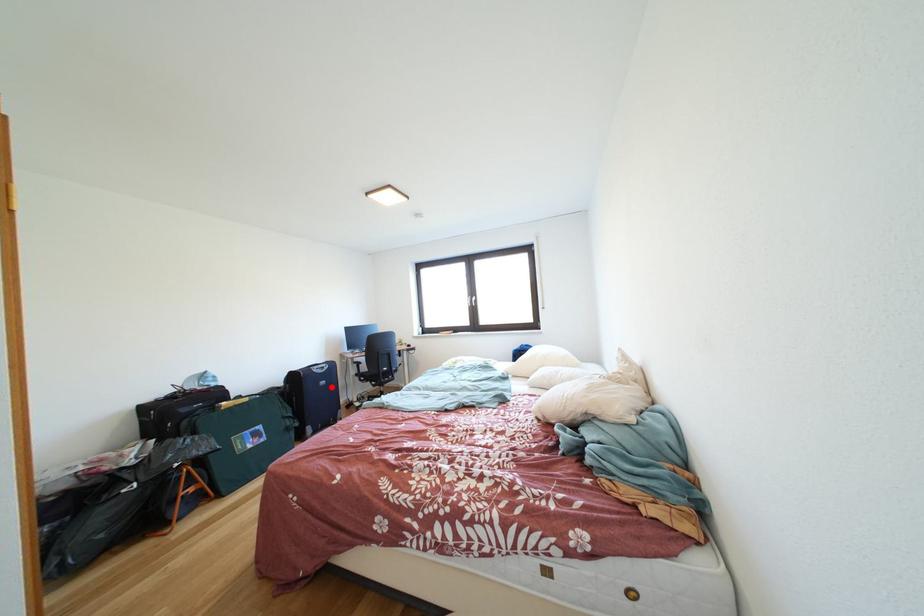
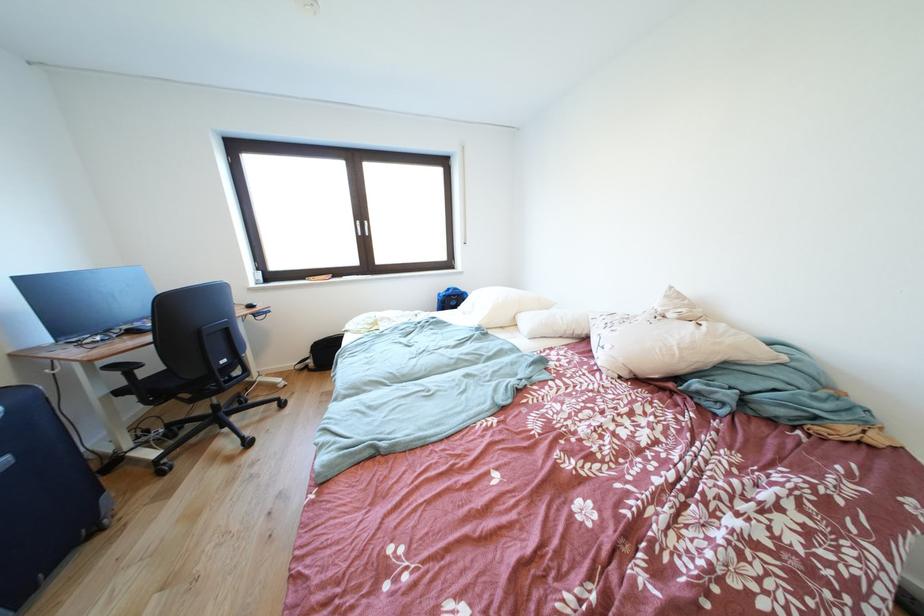
Find the pixel in the second image that matches the highlighted location in the first image.

(8, 468)